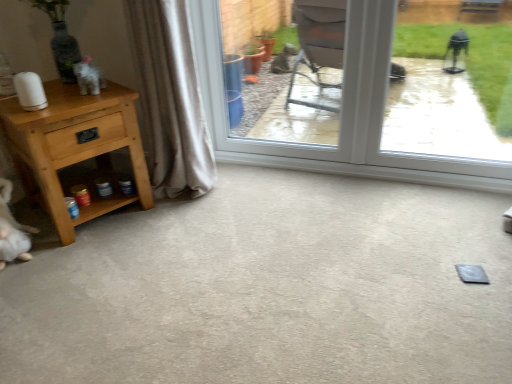
Question: Is gray carpet at lower left at the right side of beige fabric curtain at left?

Choices:
 (A) yes
 (B) no

Answer: (A)

Question: From the image's perspective, is gray carpet at lower left over beige fabric curtain at left?

Choices:
 (A) yes
 (B) no

Answer: (B)

Question: From a real-world perspective, is gray carpet at lower left physically below beige fabric curtain at left?

Choices:
 (A) no
 (B) yes

Answer: (B)

Question: Are gray carpet at lower left and beige fabric curtain at left located far from each other?

Choices:
 (A) no
 (B) yes

Answer: (A)

Question: Is beige fabric curtain at left inside gray carpet at lower left?

Choices:
 (A) no
 (B) yes

Answer: (A)

Question: Is gray carpet at lower left closer to the viewer compared to beige fabric curtain at left?

Choices:
 (A) no
 (B) yes

Answer: (B)

Question: Could you tell me if gray carpet at lower left is turned towards light brown wood nightstand at left?

Choices:
 (A) yes
 (B) no

Answer: (B)

Question: Is gray carpet at lower left at the right side of light brown wood nightstand at left?

Choices:
 (A) yes
 (B) no

Answer: (A)

Question: From a real-world perspective, is gray carpet at lower left positioned over light brown wood nightstand at left based on gravity?

Choices:
 (A) yes
 (B) no

Answer: (B)

Question: From a real-world perspective, does gray carpet at lower left sit lower than light brown wood nightstand at left?

Choices:
 (A) yes
 (B) no

Answer: (A)

Question: Is gray carpet at lower left wider than light brown wood nightstand at left?

Choices:
 (A) no
 (B) yes

Answer: (B)

Question: Is gray carpet at lower left closer to camera compared to light brown wood nightstand at left?

Choices:
 (A) no
 (B) yes

Answer: (B)

Question: Is light brown wood nightstand at left to the right of beige fabric curtain at left from the viewer's perspective?

Choices:
 (A) no
 (B) yes

Answer: (A)